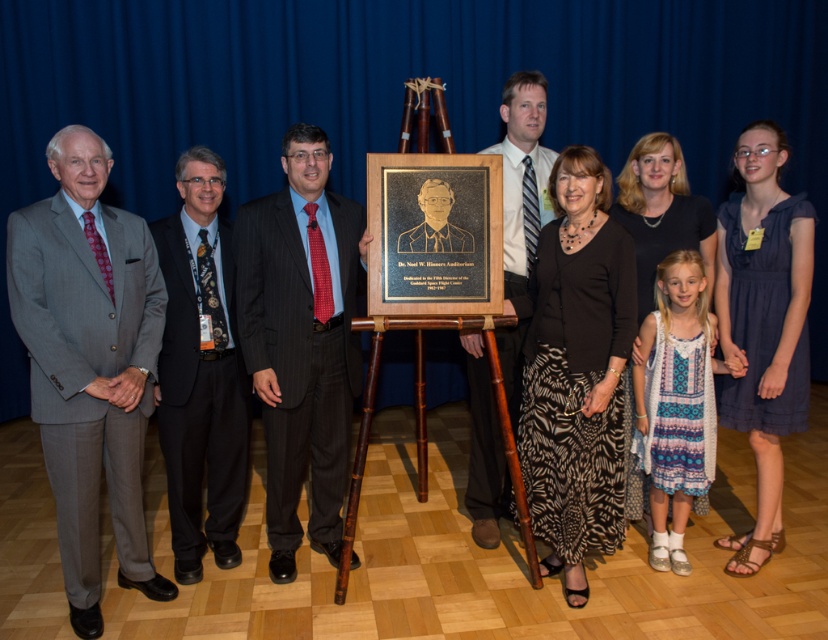
Question: Among these objects, which one is farthest from the camera?

Choices:
 (A) dark blue dress at lower right
 (B) black printed fabric skirt at center
 (C) pinstriped suit at center
 (D) gray suit at left

Answer: (C)

Question: Does gray suit at left appear over black printed fabric skirt at center?

Choices:
 (A) no
 (B) yes

Answer: (A)

Question: Based on their relative distances, which object is farther from the pinstriped suit at center?

Choices:
 (A) dark gray suit at left
 (B) gray suit at left

Answer: (B)

Question: Where is gray suit at left located in relation to dark gray suit at left in the image?

Choices:
 (A) left
 (B) right

Answer: (A)

Question: Estimate the real-world distances between objects in this image. Which object is farther from the matte black suit at center?

Choices:
 (A) black printed fabric skirt at center
 (B) dark gray suit at left

Answer: (B)

Question: Is gray suit at left closer to camera compared to black printed fabric skirt at center?

Choices:
 (A) no
 (B) yes

Answer: (B)